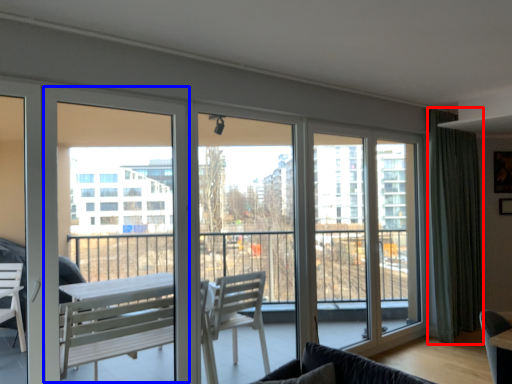
Question: Which of the following is the farthest to the observer, curtain (highlighted by a red box) or screen door (highlighted by a blue box)?

Choices:
 (A) curtain
 (B) screen door

Answer: (A)